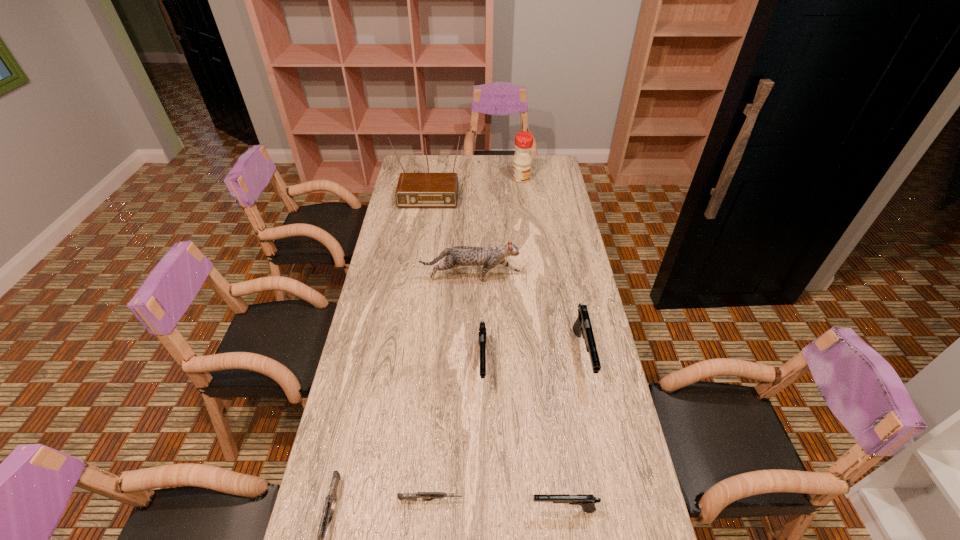
I want to click on the shortest gun, so click(x=425, y=496).

I want to click on the right grey gun, so click(425, 496).

I want to click on vacant region located 0.210m on the front panel of the radio_receiver, so click(420, 238).

In order to click on vacant region located on the front of the condiment in this screenshot , I will do `click(522, 191)`.

At what (x,y) coordinates should I click in order to perform the action: click on free spot located 0.150m on the face of the sixth shortest object. Please return your answer as a coordinate pair (x, y). Image resolution: width=960 pixels, height=540 pixels. Looking at the image, I should click on (560, 278).

Where is `vacant space located 0.150m at the aiming end of the rightmost gun`? vacant space located 0.150m at the aiming end of the rightmost gun is located at coordinates (599, 440).

The image size is (960, 540). What are the coordinates of `vacant space situated at the aiming end of the second tallest gun` in the screenshot? It's located at (483, 421).

The width and height of the screenshot is (960, 540). In order to click on free spot located at the aiming end of the second black gun from right to left in this screenshot , I will do `click(440, 509)`.

Image resolution: width=960 pixels, height=540 pixels. Identify the location of vacant space located 0.070m at the aiming end of the second black gun from right to left. (504, 509).

This screenshot has width=960, height=540. I want to click on vacant area situated at the aiming end of the second black gun from right to left, so click(x=412, y=509).